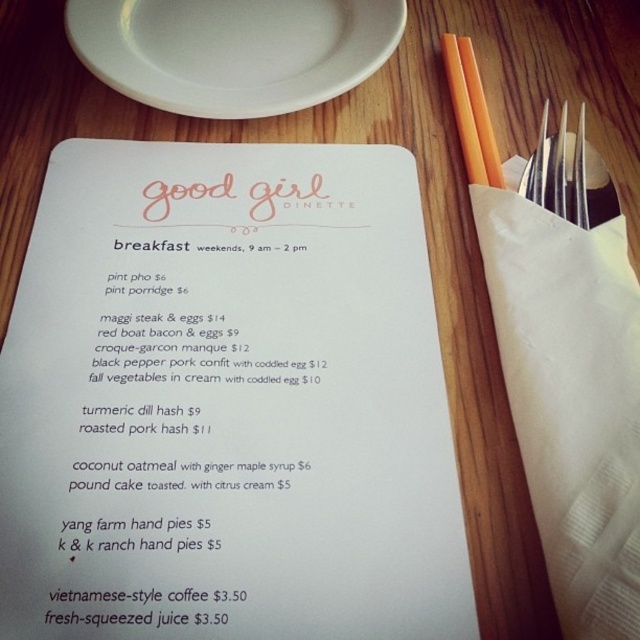
You are setting up the table for a customer at Good Girl Dinette. You have a white ceramic plate at upper left and a silver metallic fork at upper right. Which item should you place first if you want to follow the rule of placing larger items before smaller ones?

You should place the white ceramic plate at upper left first because it is larger than the silver metallic fork at upper right.

You are a customer at Good Girl Dinette and want to place your silver metallic fork at upper right on the white ceramic plate at upper left. Can you fit it based on their sizes?

The white ceramic plate at upper left is taller than the silver metallic fork at upper right, so yes, the fork can be placed on the plate since it is smaller in height.

You are a customer at Good Girl Dinette and want to choose between the silver metallic fork at upper right and the orange plastic chopsticks at upper right. Which one is located above the other?

The orange plastic chopsticks at upper right are above the silver metallic fork at upper right because the fork is positioned under the chopsticks.